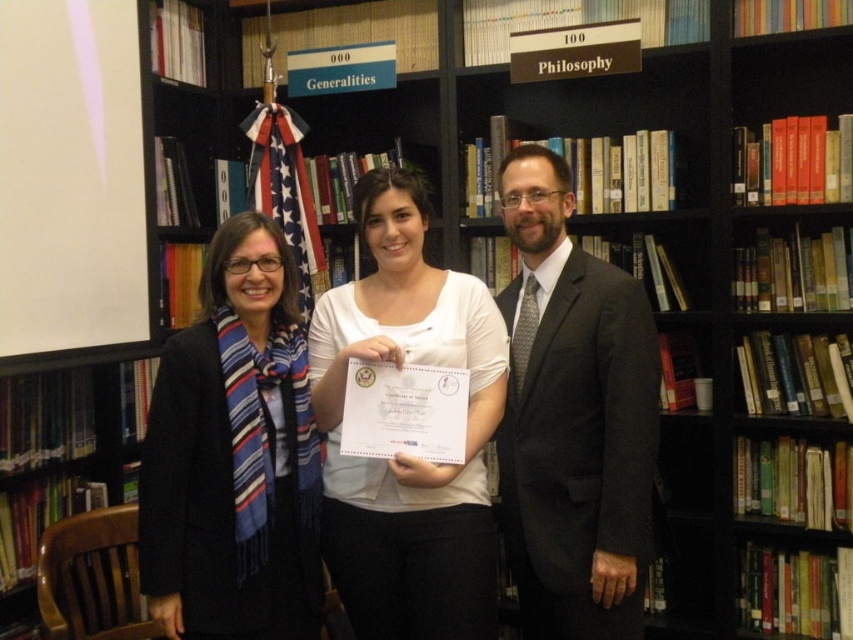
Question: Which of the following is the farthest from the observer?

Choices:
 (A) (276, 305)
 (B) (592, 609)
 (C) (440, 572)

Answer: (A)

Question: Is blue striped scarf at left wider than white matte certificate at center?

Choices:
 (A) yes
 (B) no

Answer: (B)

Question: Among these objects, which one is nearest to the camera?

Choices:
 (A) white matte certificate at center
 (B) dark gray suit at center
 (C) blue striped scarf at left

Answer: (C)

Question: Does blue striped scarf at left have a smaller size compared to white matte certificate at center?

Choices:
 (A) yes
 (B) no

Answer: (A)

Question: Which is nearer to the blue striped scarf at left?

Choices:
 (A) white matte certificate at center
 (B) dark gray suit at center

Answer: (A)

Question: Can you confirm if blue striped scarf at left is thinner than white matte certificate at center?

Choices:
 (A) no
 (B) yes

Answer: (B)